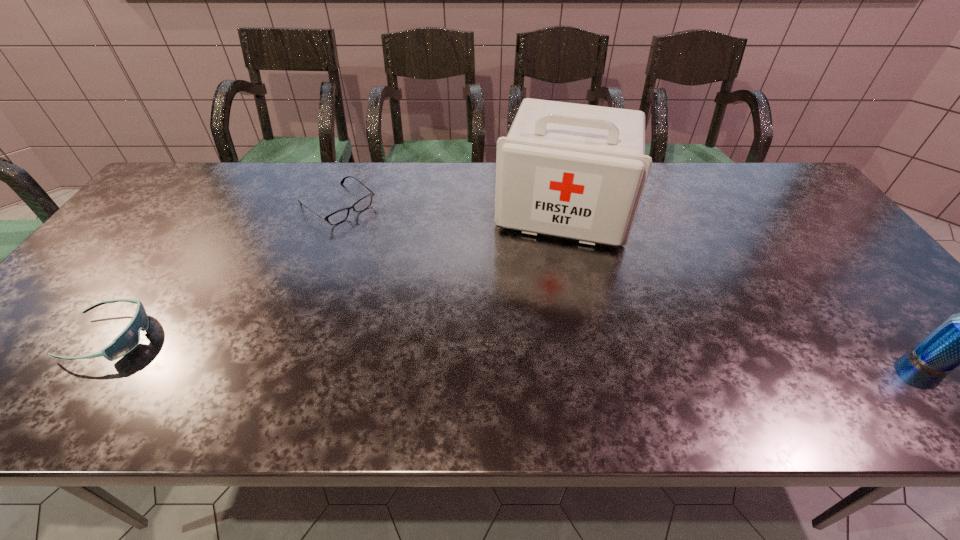
Identify the location of free spot on the desktop that is between the third tallest object and the third shortest object and is positioned on the front-facing side of the second object from left to right. (531, 349).

What are the coordinates of `free space on the desktop that is between the leftmost object and the beer can and is positioned on the front-facing side of the tallest object` in the screenshot? It's located at (532, 349).